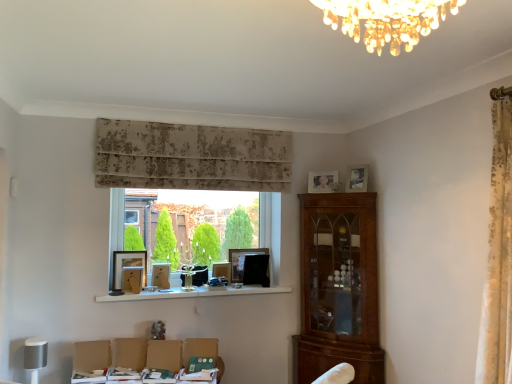
Question: From a real-world perspective, is matte black picture frame at center, which is the third picture frame in left-to-right order, above or below clear glass window at center?

Choices:
 (A) below
 (B) above

Answer: (A)

Question: Considering the positions of matte black picture frame at center, which is the third picture frame in left-to-right order, and clear glass window at center in the image, is matte black picture frame at center, which is the third picture frame in left-to-right order, wider or thinner than clear glass window at center?

Choices:
 (A) wide
 (B) thin

Answer: (B)

Question: Estimate the real-world distances between objects in this image. Which object is closer to the matte brown armchair at lower center?

Choices:
 (A) matte black picture frame at center, the 4th picture frame positioned from the right
 (B) clear glass window at center
 (C) matte wooden picture frame at upper right, which is counted as the 2th picture frame, starting from the right
 (D) white glossy shelf at center
 (E) cardboard box at lower left, the 1th swivel chair positioned from the left

Answer: (E)

Question: Which object is positioned closest to the beige textured curtain at upper center?

Choices:
 (A) white glossy shelf at center
 (B) matte silver picture frame at upper right, positioned as the 1th picture frame in right-to-left order
 (C) matte black picture frame at center, the 4th picture frame positioned from the right
 (D) clear glass window at center
 (E) matte black picture frame at center, which appears as the 3th picture frame when viewed from the right

Answer: (D)